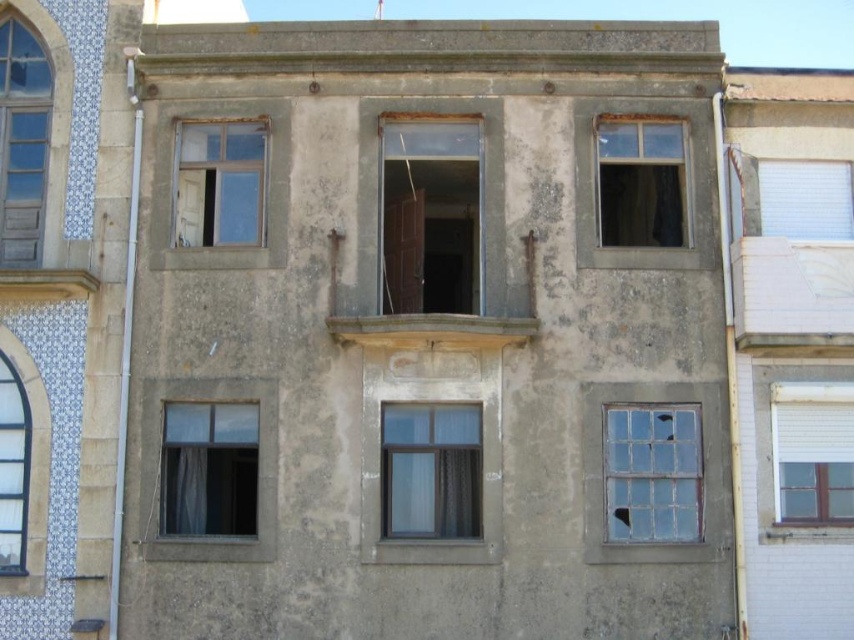
Question: Is white matte window at lower right positioned in front of clear glass window at upper right?

Choices:
 (A) no
 (B) yes

Answer: (B)

Question: Does clear glass window at lower right have a greater width compared to clear glass window at upper right?

Choices:
 (A) yes
 (B) no

Answer: (A)

Question: Based on their relative distances, which object is farther from the clear glass window at left?

Choices:
 (A) matte glass window at upper left
 (B) clear glass window at upper right

Answer: (B)

Question: Based on their relative distances, which object is nearer to the clear glass window at lower right?

Choices:
 (A) wooden door at center
 (B) white textured blinds at upper right
 (C) clear glass window at left

Answer: (B)

Question: Is matte glass window at upper left wider than white textured blinds at upper right?

Choices:
 (A) yes
 (B) no

Answer: (B)

Question: Which object is positioned closest to the clear glass window at upper right?

Choices:
 (A) clear glass window at center
 (B) white matte window at lower right

Answer: (B)